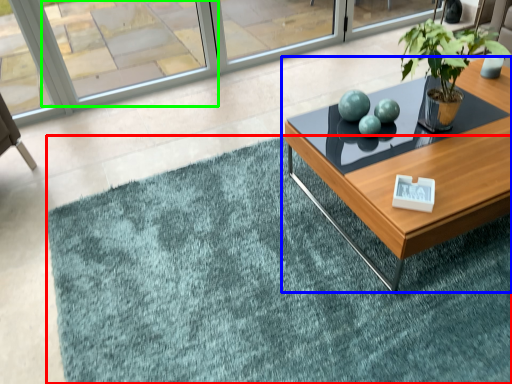
Question: Based on their relative distances, which object is nearer to doormat (highlighted by a red box)? Choose from coffee table (highlighted by a blue box) and window (highlighted by a green box).

Choices:
 (A) coffee table
 (B) window

Answer: (A)